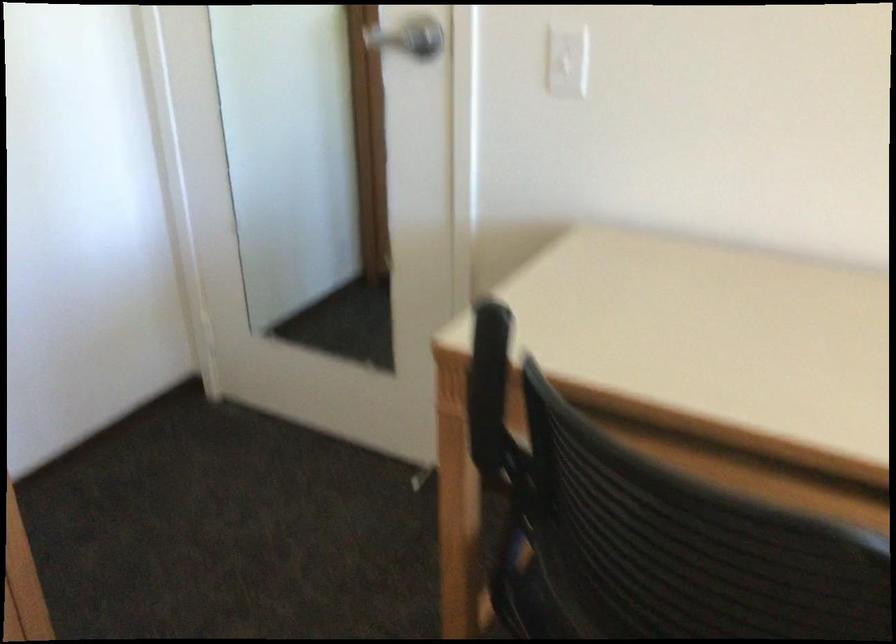
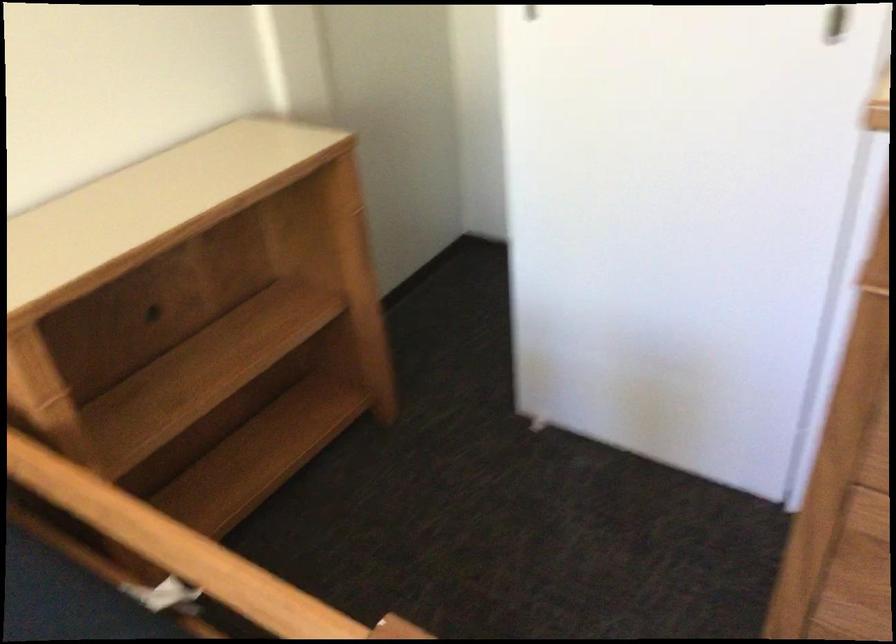
Based on the photo, first-person continuous shooting, in which direction is the camera rotating?

The camera's rotation is toward left-down.